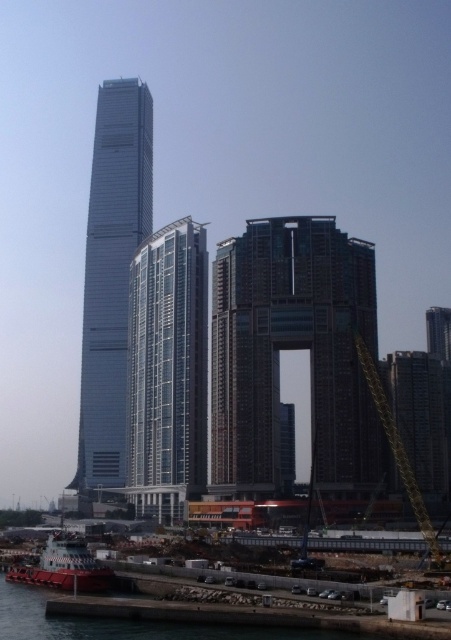
Who is lower down, brown textured building at center or glassy steel building at center?

glassy steel building at center is below.

Can you confirm if brown textured building at center is taller than glassy steel building at center?

No.

Who is more distant from viewer, [325,240] or [161,248]?

The point [161,248] is behind.

Find the location of a particular element. Image resolution: width=451 pixels, height=640 pixels. brown textured building at center is located at coordinates (291, 349).

Who is lower down, smooth glass skyscraper at center or clear water at lower left?

Positioned lower is clear water at lower left.

Is smooth glass skyscraper at center wider than clear water at lower left?

No, smooth glass skyscraper at center is not wider than clear water at lower left.

You are a GUI agent. You are given a task and a screenshot of the screen. Output one action in this format:
    pyautogui.click(x=<x>, y=<y>)
    Task: Click on the smooth glass skyscraper at center
    The width and height of the screenshot is (451, 640).
    Given the screenshot: What is the action you would take?
    pyautogui.click(x=111, y=275)

Between point (41, 561) and point (372, 381), which one is positioned in front?

Point (41, 561) is more forward.

Which of these two, metallic red boat at lower left or yellow metallic crane at lower right, stands taller?

With more height is yellow metallic crane at lower right.

Is point (99, 584) less distant than point (364, 348)?

Yes, point (99, 584) is closer to viewer.

Find the location of `metallic red boat at lower left`. metallic red boat at lower left is located at coordinates (64, 566).